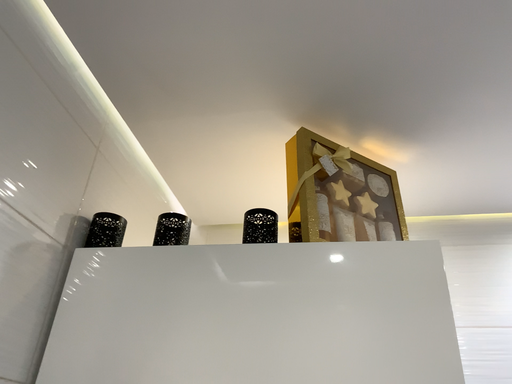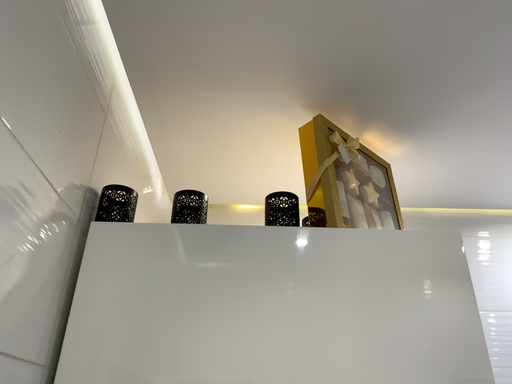
Question: How did the camera likely rotate when shooting the video?

Choices:
 (A) rotated left
 (B) rotated right

Answer: (B)